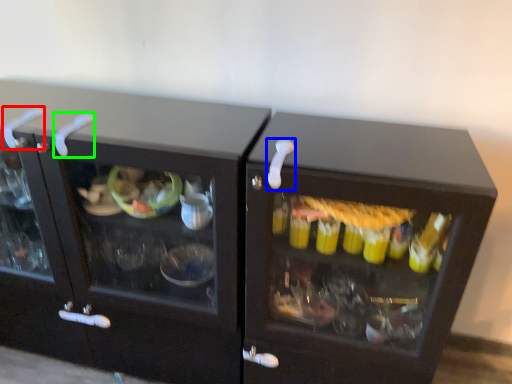
Question: Estimate the real-world distances between objects in this image. Which object is closer to door handle (highlighted by a red box), door handle (highlighted by a blue box) or door handle (highlighted by a green box)?

Choices:
 (A) door handle
 (B) door handle

Answer: (B)